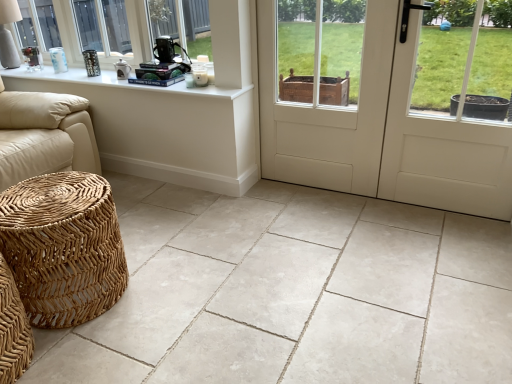
Question: Does white wood screen door at center appear on the left side of white matte door at center?

Choices:
 (A) yes
 (B) no

Answer: (A)

Question: From the image's perspective, is white wood screen door at center located above white matte door at center?

Choices:
 (A) no
 (B) yes

Answer: (B)

Question: From the image's perspective, is white wood screen door at center located beneath white matte door at center?

Choices:
 (A) no
 (B) yes

Answer: (A)

Question: Is white wood screen door at center surrounding white matte door at center?

Choices:
 (A) yes
 (B) no

Answer: (B)

Question: From a real-world perspective, is white wood screen door at center below white matte door at center?

Choices:
 (A) no
 (B) yes

Answer: (A)

Question: Is white ceramic table lamp at upper left taller or shorter than woven rattan stool at lower left?

Choices:
 (A) short
 (B) tall

Answer: (A)

Question: Relative to woven rattan stool at lower left, is white ceramic table lamp at upper left in front or behind?

Choices:
 (A) front
 (B) behind

Answer: (B)

Question: From a real-world perspective, is white ceramic table lamp at upper left positioned above or below woven rattan stool at lower left?

Choices:
 (A) below
 (B) above

Answer: (B)

Question: Which is correct: white ceramic table lamp at upper left is inside woven rattan stool at lower left, or outside of it?

Choices:
 (A) outside
 (B) inside

Answer: (A)

Question: Is white matte door at center inside or outside of woven rattan stool at lower left?

Choices:
 (A) inside
 (B) outside

Answer: (B)

Question: Is white matte door at center bigger or smaller than woven rattan stool at lower left?

Choices:
 (A) big
 (B) small

Answer: (A)

Question: Is white matte door at center taller or shorter than woven rattan stool at lower left?

Choices:
 (A) tall
 (B) short

Answer: (A)

Question: Does point coord(460,112) appear closer or farther from the camera than point coord(222,157)?

Choices:
 (A) farther
 (B) closer

Answer: (B)

Question: Considering the positions of white matte door at center and natural stone tile at lower left in the image, is white matte door at center wider or thinner than natural stone tile at lower left?

Choices:
 (A) thin
 (B) wide

Answer: (A)

Question: Is white matte door at center taller or shorter than natural stone tile at lower left?

Choices:
 (A) short
 (B) tall

Answer: (B)